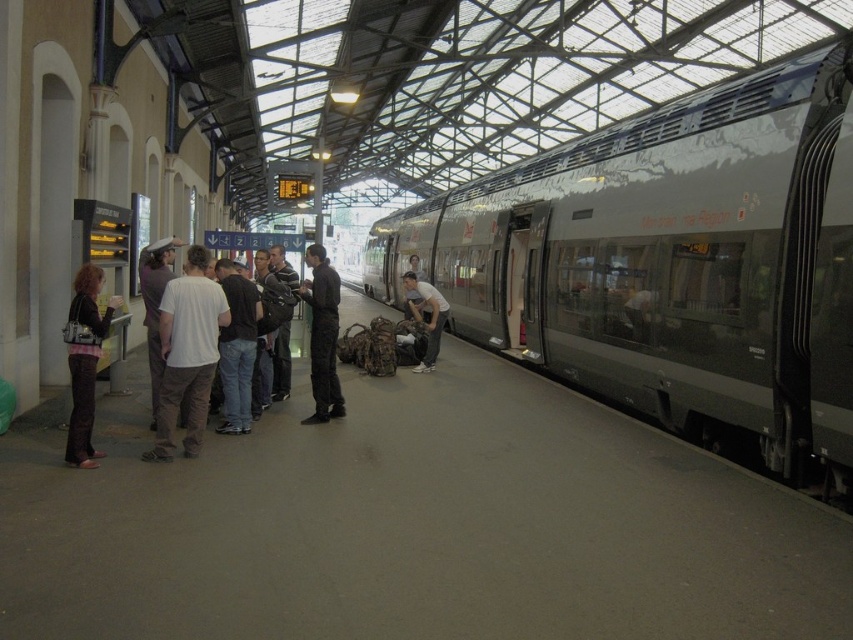
You are a photographer standing on the train station platform. You want to take a photo of the matte black jacket at left and the matte white shirt at center. Which object should you focus on first if you want to capture both clearly in the same frame without moving the camera?

The matte black jacket at left is thinner than the matte white shirt at center, so you should focus on the matte white shirt at center first because it is larger and will require more precise focus to ensure clarity in the photo.